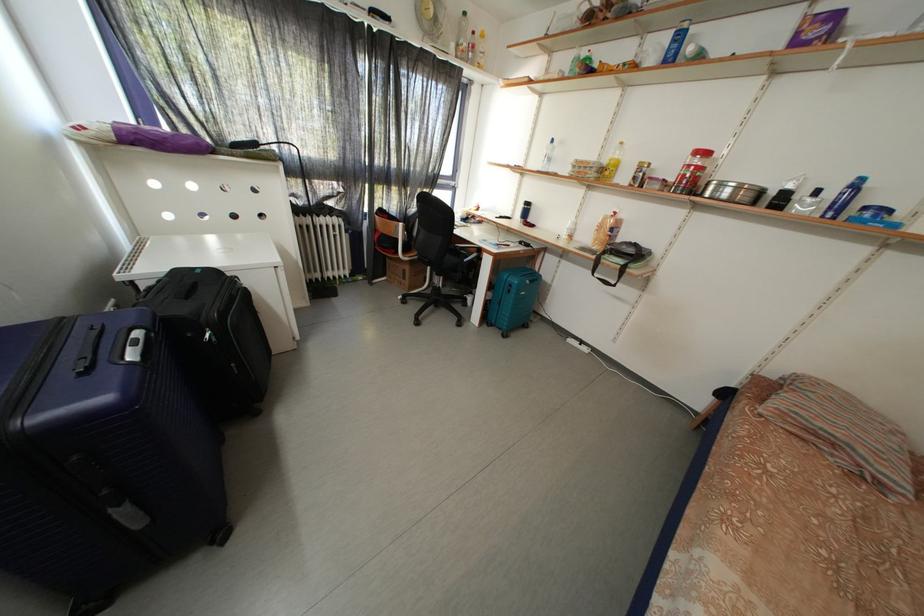
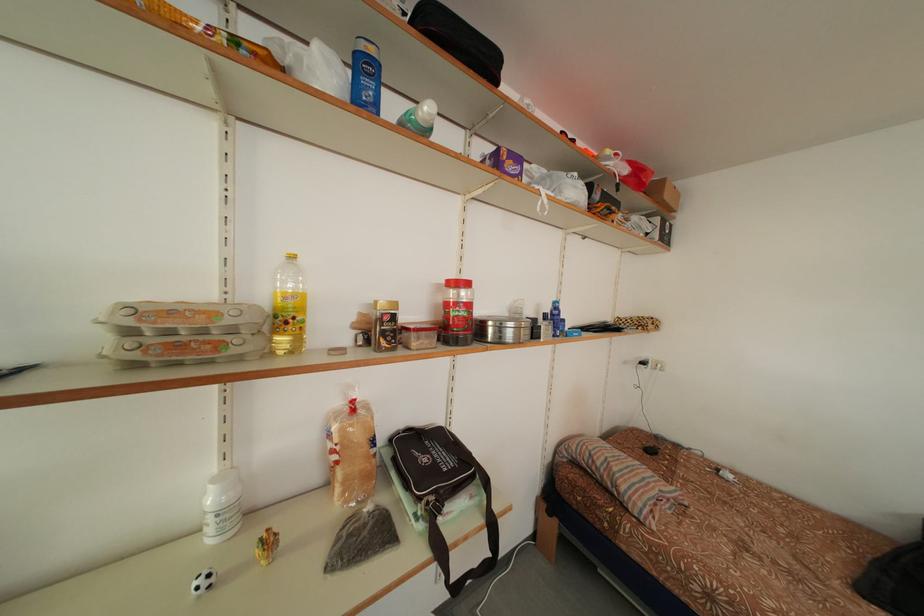
In the second image, find the point that corresponds to point (824, 198) in the first image.

(553, 322)